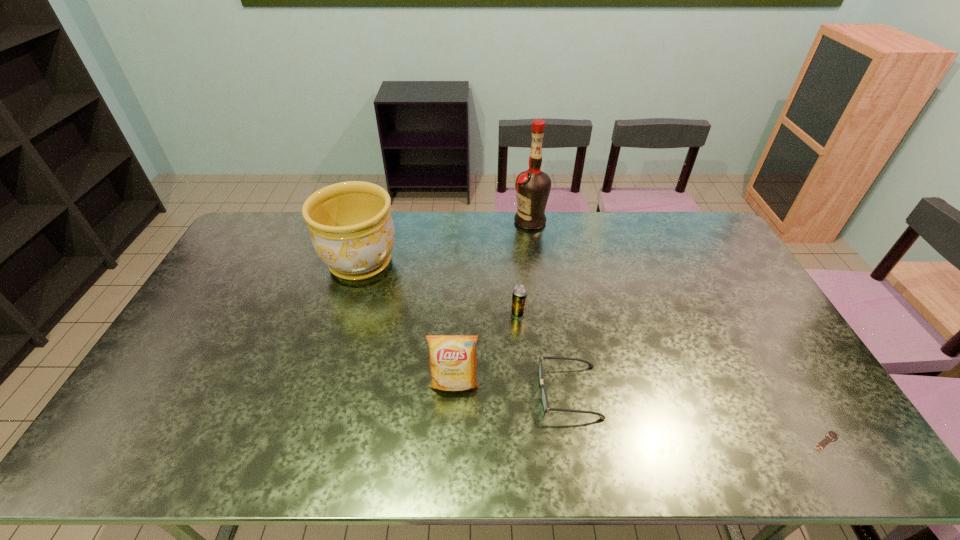
Where is `vacant area that lies between the fourth tallest object and the third tallest object`? vacant area that lies between the fourth tallest object and the third tallest object is located at coordinates (487, 348).

I want to click on unoccupied position between the nearest object and the spectacles, so click(x=697, y=417).

Find the location of a particular element. This screenshot has width=960, height=540. object that is the fourth closest to the third shortest object is located at coordinates (533, 186).

This screenshot has height=540, width=960. Identify the location of the third closest object relative to the leftmost object. (533, 186).

What are the coordinates of `vacant space that satisfies the following two spatial constraints: 1. on the face of the nearest object; 2. on the right side of the fifth tallest object` in the screenshot? It's located at 577,441.

The height and width of the screenshot is (540, 960). What are the coordinates of `vacant space that satisfies the following two spatial constraints: 1. on the front and back of the rightmost object; 2. on the left side of the farthest object` in the screenshot? It's located at (561, 441).

Locate an element on the screen. The height and width of the screenshot is (540, 960). vacant space that satisfies the following two spatial constraints: 1. on the front-facing side of the shortest object; 2. on the right side of the fifth object from right to left is located at coordinates (451, 441).

Image resolution: width=960 pixels, height=540 pixels. I want to click on free space that satisfies the following two spatial constraints: 1. on the face of the shortest object; 2. on the left side of the spectacles, so click(577, 441).